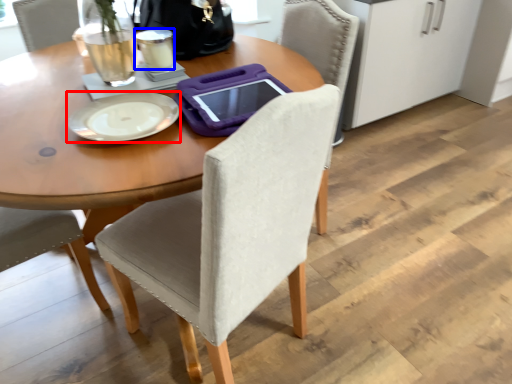
Question: Among these objects, which one is nearest to the camera, plate (highlighted by a red box) or coffee cup (highlighted by a blue box)?

Choices:
 (A) plate
 (B) coffee cup

Answer: (A)